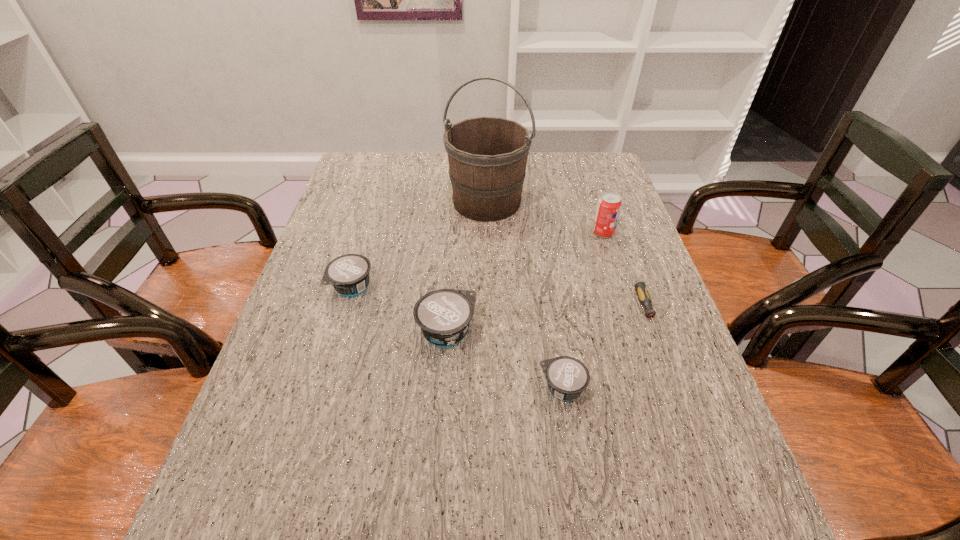
Where is `vacant space located 0.090m on the front of the second yogurt from right to left`? vacant space located 0.090m on the front of the second yogurt from right to left is located at coordinates [x=443, y=393].

Identify the location of vacant position located on the left of the nearest object. (343, 388).

In order to click on free space located on the back of the tallest object in this screenshot , I will do `click(486, 154)`.

This screenshot has width=960, height=540. In order to click on vacant area situated 0.170m on the back of the soda can in this screenshot , I will do `click(590, 193)`.

At what (x,y) coordinates should I click in order to perform the action: click on vacant space situated insert the shortest object into a screw head. Please return your answer as a coordinate pair (x, y). Looking at the image, I should click on (681, 407).

The image size is (960, 540). Identify the location of object present at the far edge. (487, 156).

At what (x,y) coordinates should I click in order to perform the action: click on object located at the left edge. Please return your answer as a coordinate pair (x, y). Looking at the image, I should click on (349, 274).

This screenshot has width=960, height=540. What are the coordinates of `soda can that is positioned at the right edge` in the screenshot? It's located at (609, 205).

At what (x,y) coordinates should I click in order to perform the action: click on screwdriver located in the right edge section of the desktop. Please return your answer as a coordinate pair (x, y). This screenshot has width=960, height=540. Looking at the image, I should click on (641, 289).

Find the location of a particular element. The width and height of the screenshot is (960, 540). free space at the far edge of the desktop is located at coordinates (417, 177).